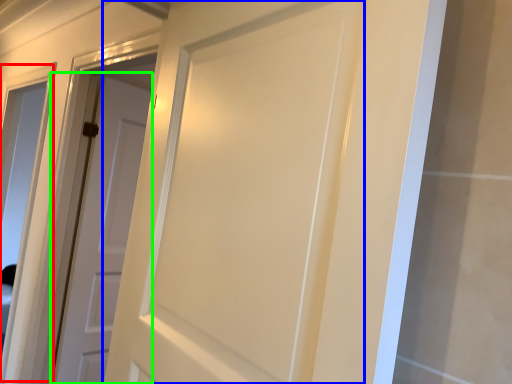
Question: Which object is positioned farthest from window (highlighted by a red box)? Select from door (highlighted by a blue box) and door (highlighted by a green box).

Choices:
 (A) door
 (B) door

Answer: (A)